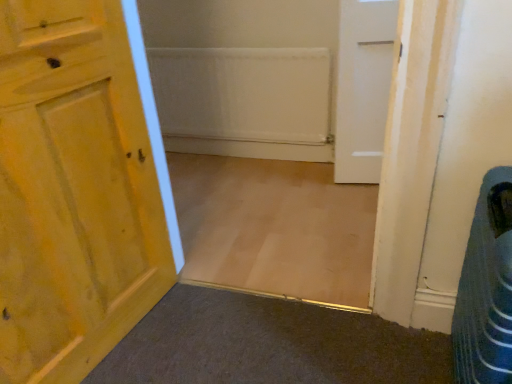
Question: Is white matte door at upper right, positioned as the 1th door in back-to-front order, smaller than blue striped fabric laundry basket at lower right?

Choices:
 (A) yes
 (B) no

Answer: (A)

Question: Does white matte door at upper right, the 1th door viewed from the right, have a lesser height compared to blue striped fabric laundry basket at lower right?

Choices:
 (A) yes
 (B) no

Answer: (B)

Question: Is white matte door at upper right, positioned as the 1th door in back-to-front order, located outside blue striped fabric laundry basket at lower right?

Choices:
 (A) yes
 (B) no

Answer: (A)

Question: From a real-world perspective, is white matte door at upper right, the 1th door viewed from the right, beneath blue striped fabric laundry basket at lower right?

Choices:
 (A) no
 (B) yes

Answer: (A)

Question: Is white matte door at upper right, which is the second door in front-to-back order, oriented away from blue striped fabric laundry basket at lower right?

Choices:
 (A) yes
 (B) no

Answer: (B)

Question: From their relative heights in the image, would you say blue striped fabric laundry basket at lower right is taller or shorter than white matte door at upper right, positioned as the 1th door in back-to-front order?

Choices:
 (A) tall
 (B) short

Answer: (B)

Question: From the image's perspective, is blue striped fabric laundry basket at lower right positioned above or below white matte door at upper right, which is the second door in front-to-back order?

Choices:
 (A) below
 (B) above

Answer: (A)

Question: Would you say blue striped fabric laundry basket at lower right is to the left or to the right of white matte door at upper right, the 1th door viewed from the right, in the picture?

Choices:
 (A) right
 (B) left

Answer: (A)

Question: In the image, is blue striped fabric laundry basket at lower right positioned in front of or behind white matte door at upper right, positioned as the 1th door in back-to-front order?

Choices:
 (A) front
 (B) behind

Answer: (A)

Question: In terms of width, does white matte door at upper right, positioned as the 1th door in back-to-front order, look wider or thinner when compared to wooden door at left, which is the 2th door in right-to-left order?

Choices:
 (A) wide
 (B) thin

Answer: (B)

Question: Considering the positions of white matte door at upper right, positioned as the 2th door in left-to-right order, and wooden door at left, which is counted as the 1th door, starting from the left, in the image, is white matte door at upper right, positioned as the 2th door in left-to-right order, taller or shorter than wooden door at left, which is counted as the 1th door, starting from the left,?

Choices:
 (A) tall
 (B) short

Answer: (B)

Question: Is point (356, 124) positioned closer to the camera than point (50, 86)?

Choices:
 (A) farther
 (B) closer

Answer: (A)

Question: Considering the relative positions of white matte door at upper right, the 1th door viewed from the right, and wooden door at left, which is the 2th door in right-to-left order, in the image provided, is white matte door at upper right, the 1th door viewed from the right, to the left or to the right of wooden door at left, which is the 2th door in right-to-left order,?

Choices:
 (A) right
 (B) left

Answer: (A)

Question: In terms of height, does wooden door at left, which is counted as the 1th door, starting from the left, look taller or shorter compared to white matte door at upper right, positioned as the 1th door in back-to-front order?

Choices:
 (A) tall
 (B) short

Answer: (A)

Question: From a real-world perspective, is wooden door at left, which is the 2th door in right-to-left order, physically located above or below white matte door at upper right, positioned as the 1th door in back-to-front order?

Choices:
 (A) above
 (B) below

Answer: (A)